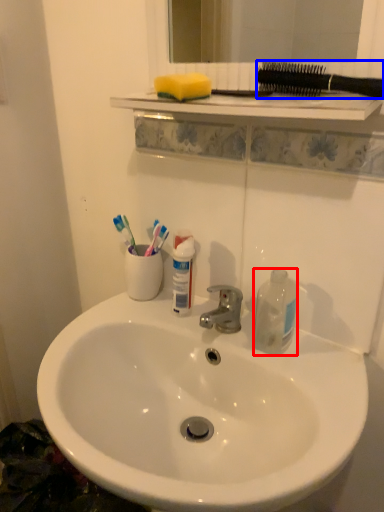
Question: Which object is further to the camera taking this photo, bottle (highlighted by a red box) or toothbrushes (highlighted by a blue box)?

Choices:
 (A) bottle
 (B) toothbrushes

Answer: (A)